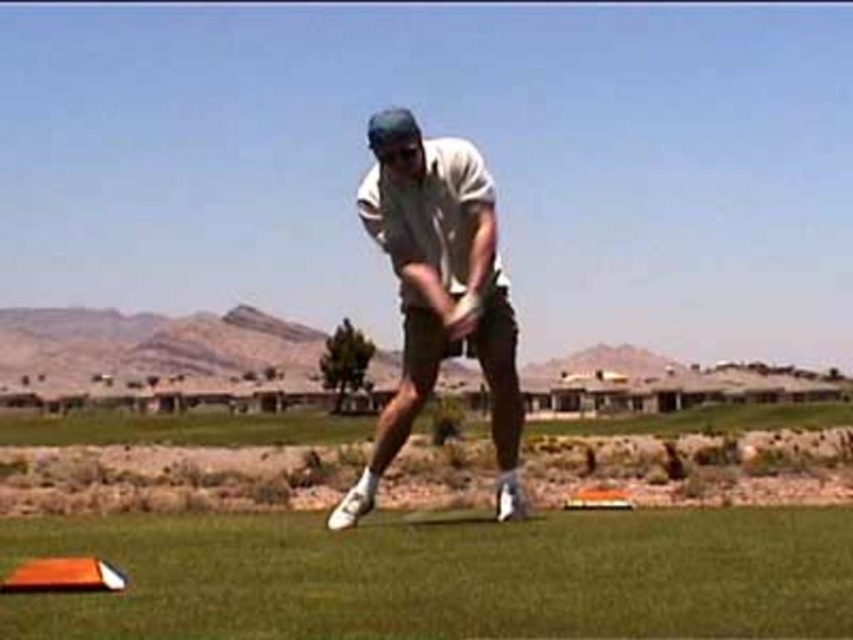
Can you confirm if green artificial turf at lower center is positioned to the right of white matte golf club at center?

Correct, you'll find green artificial turf at lower center to the right of white matte golf club at center.

Is point (32, 609) less distant than point (387, 250)?

Yes, it is in front of point (387, 250).

Locate an element on the screen. green artificial turf at lower center is located at coordinates (445, 577).